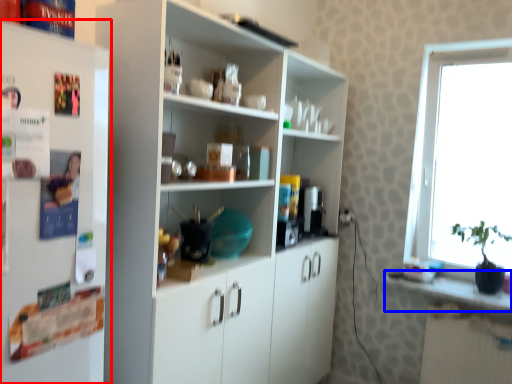
Question: Among these objects, which one is farthest to the camera, refrigerator (highlighted by a red box) or counter top (highlighted by a blue box)?

Choices:
 (A) refrigerator
 (B) counter top

Answer: (B)